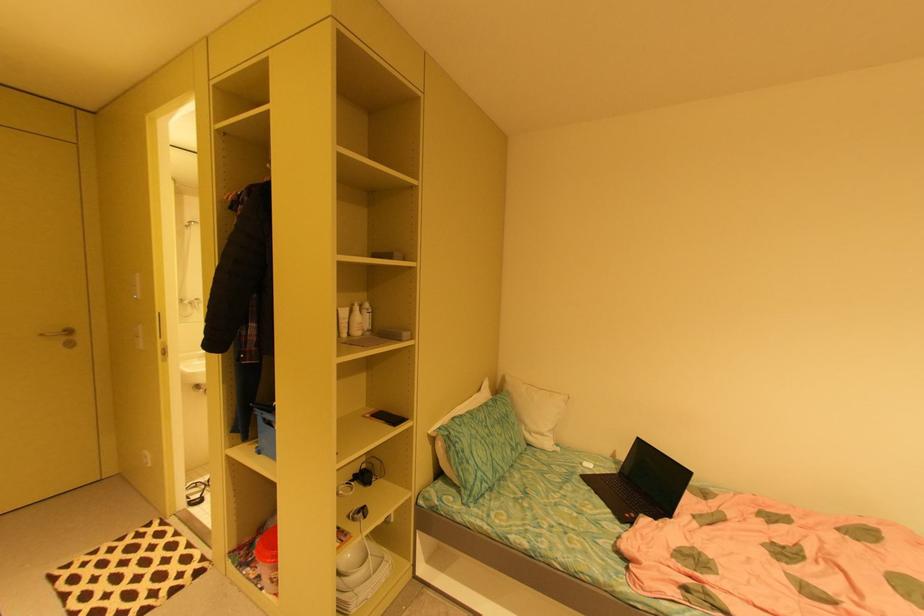
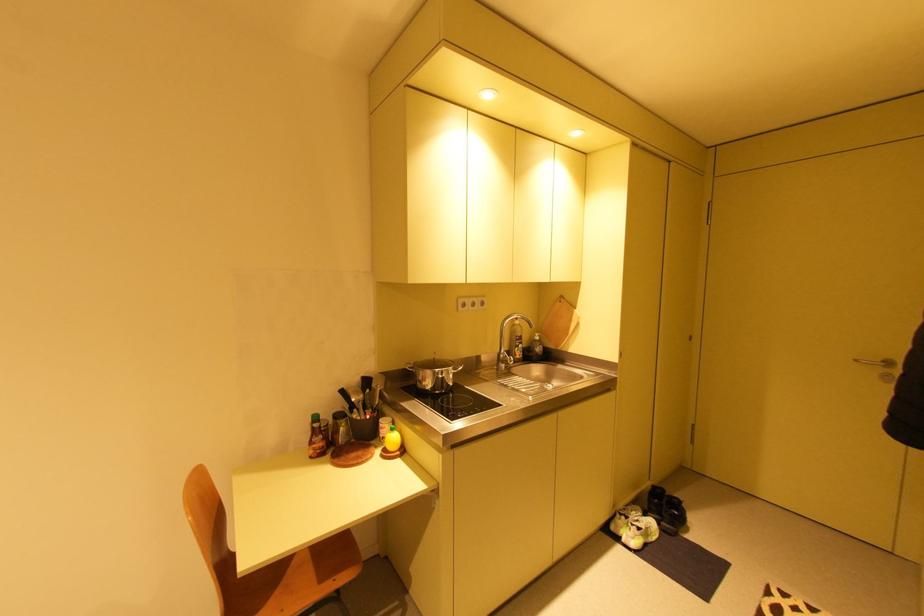
Locate, in the second image, the point that corresponds to point 49,334 in the first image.

(861, 361)